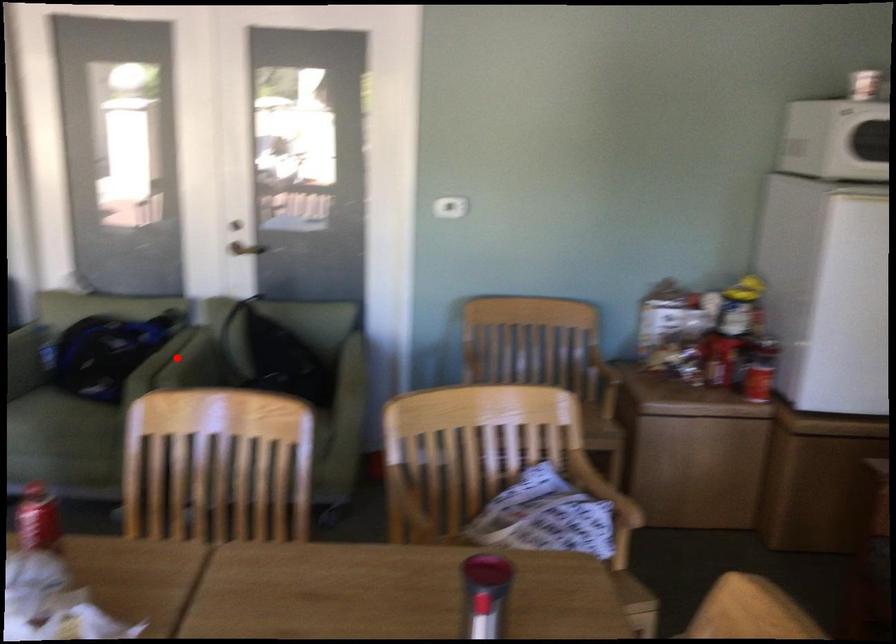
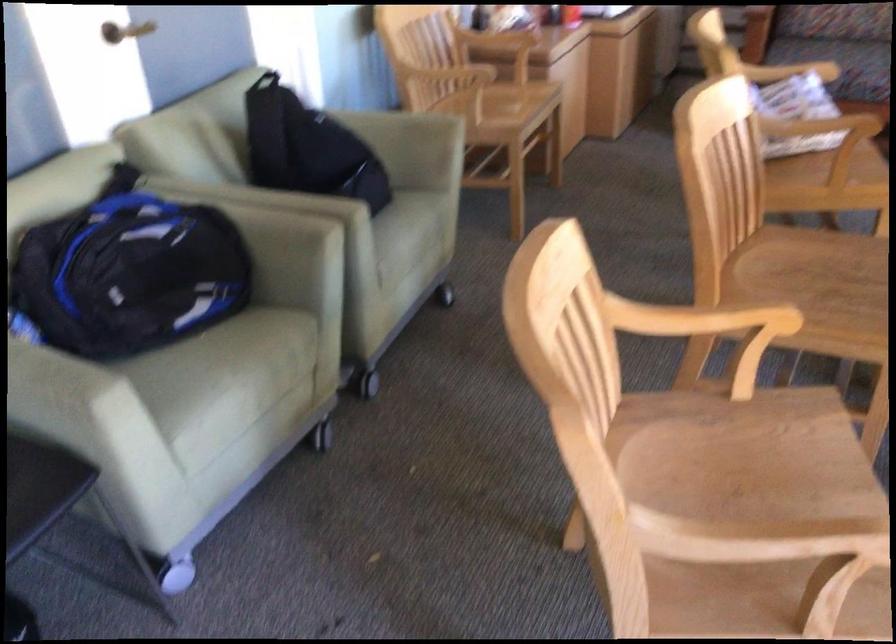
Question: I am providing you with two images of the same scene from different viewpoints. In image1, a red point is highlighted. Considering the same 3D point in image2, which of the following is correct?

Choices:
 (A) It is closer
 (B) It is farther

Answer: (A)